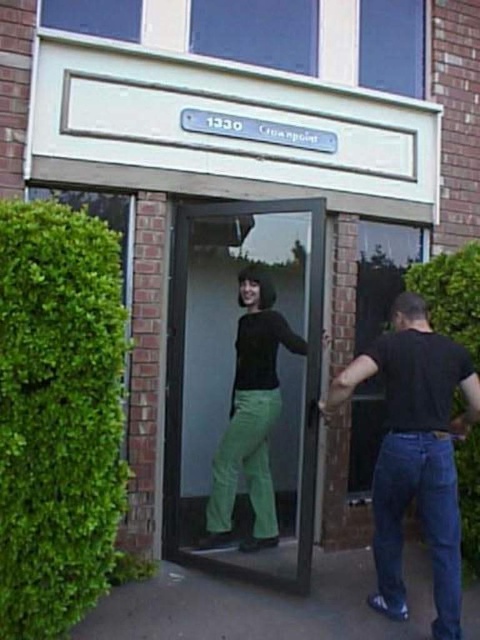
You are a delivery person standing at the entrance of the building with a package. You need to hand the package to the man wearing the matte black shirt at center. The transparent glass door at center is in your way. Can you step aside to avoid the door and reach the man?

The transparent glass door at center is only 30.94 centimeters away from the matte black shirt at center, so stepping aside might not be necessary. You can simply reach the man by moving slightly to the side since the distance between them is relatively small.

You are standing in front of the building and want to enter through the transparent glass door at center. There is a person wearing a matte black shirt at center blocking your path. Can you walk around them to reach the door?

The transparent glass door at center is closer to the viewer than the matte black shirt at center, so the person is behind the door. You can walk around them to reach the door.

You are a fashion designer observing two shirts in the scene. The black cotton shirt at right and the matte black shirt at center. Which shirt has a greater width?

The black cotton shirt at right has a greater width than the matte black shirt at center.